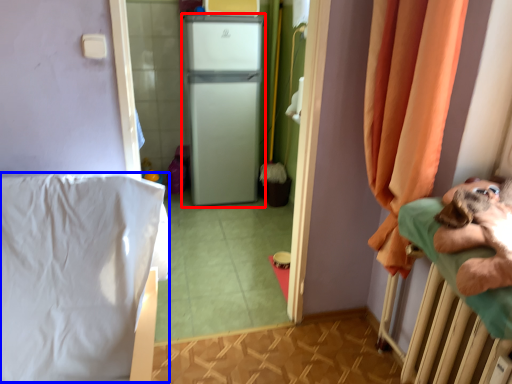
Question: Which object appears farthest to the camera in this image, appliance (highlighted by a red box) or sheet (highlighted by a blue box)?

Choices:
 (A) appliance
 (B) sheet

Answer: (A)